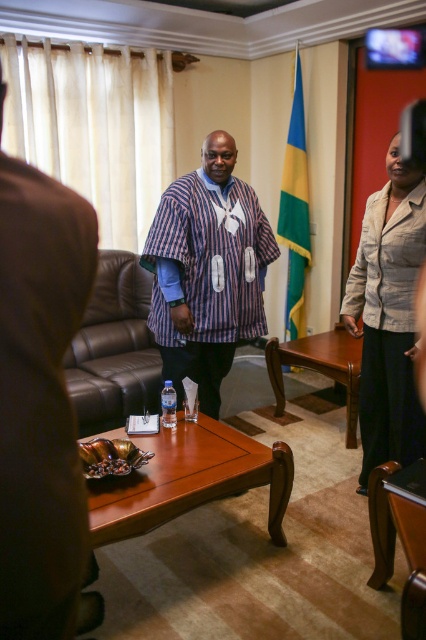
Based on the scene description, where is the striped fabric shirt at center located in relation to the point marked at coordinates (x=207, y=272)?

The point marked at coordinates (x=207, y=272) corresponds to the striped fabric shirt at center, so they are in the same location.

You are standing in the meeting room and want to take a photo of the striped fabric shirt at center. If your camera has a minimum focus distance of 5 feet, will you be able to capture the shirt clearly?

The striped fabric shirt at center is 7.49 feet away from the camera, which is beyond the minimum focus distance of 5 feet. Therefore, the camera should be able to capture the shirt clearly as it is within the focus range.

You are attending a meeting in the room and need to adjust your seating to face the striped fabric at center and the light beige fabric jacket at right. Which direction should you turn to face both objects?

The striped fabric at center is below the light beige fabric jacket at right, so you should turn to face the lower direction to see the striped fabric at center and the right side to see the light beige fabric jacket at right.